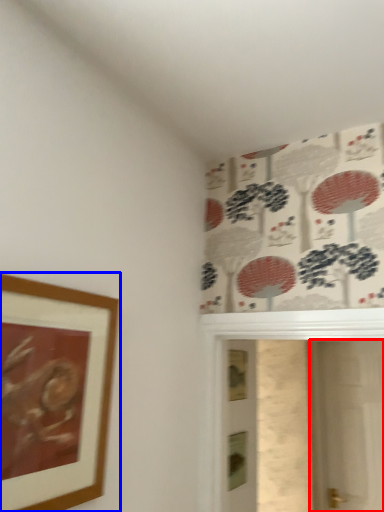
Question: Which of the following is the farthest to the observer, screen door (highlighted by a red box) or picture frame (highlighted by a blue box)?

Choices:
 (A) screen door
 (B) picture frame

Answer: (A)